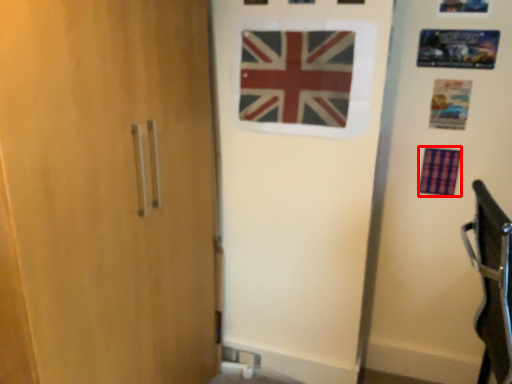
Question: From the image's perspective, what is the correct spatial relationship of flag (annotated by the red box) in relation to flag?

Choices:
 (A) above
 (B) below

Answer: (B)